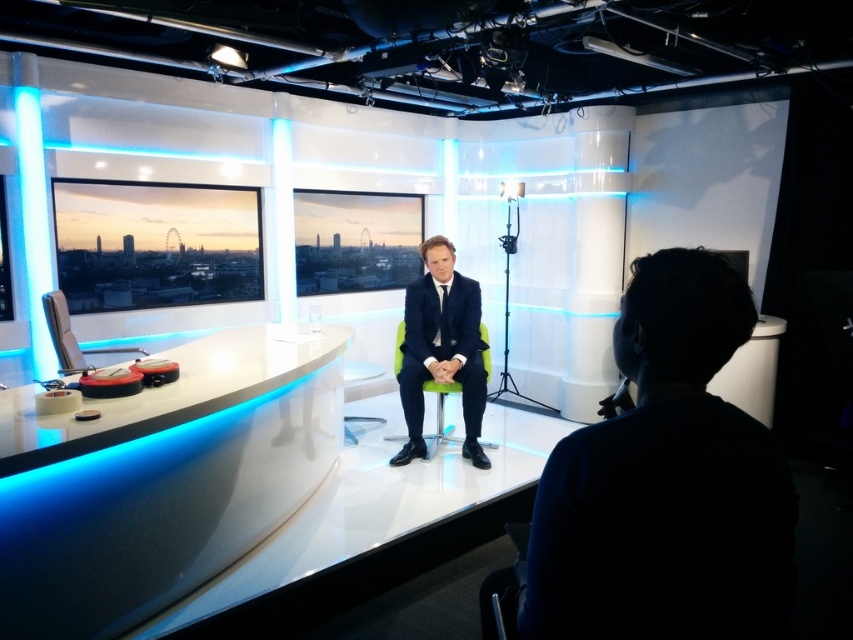
Question: Does dark blue fabric at center have a greater width compared to matte black chair at left?

Choices:
 (A) yes
 (B) no

Answer: (B)

Question: Which point appears farthest from the camera in this image?

Choices:
 (A) (421, 285)
 (B) (490, 372)
 (C) (654, 566)
 (D) (53, 332)

Answer: (B)

Question: Considering the relative positions of navy blue suit at center and green fabric chair at center in the image provided, where is navy blue suit at center located with respect to green fabric chair at center?

Choices:
 (A) above
 (B) below

Answer: (A)

Question: Considering the relative positions of dark blue fabric at center and matte black chair at left in the image provided, where is dark blue fabric at center located with respect to matte black chair at left?

Choices:
 (A) below
 (B) above

Answer: (A)

Question: Among these points, which one is farthest from the camera?

Choices:
 (A) (132, 346)
 (B) (395, 436)

Answer: (B)

Question: Among these objects, which one is nearest to the camera?

Choices:
 (A) dark blue fabric at center
 (B) matte black chair at left
 (C) navy blue suit at center
 (D) green fabric chair at center

Answer: (A)